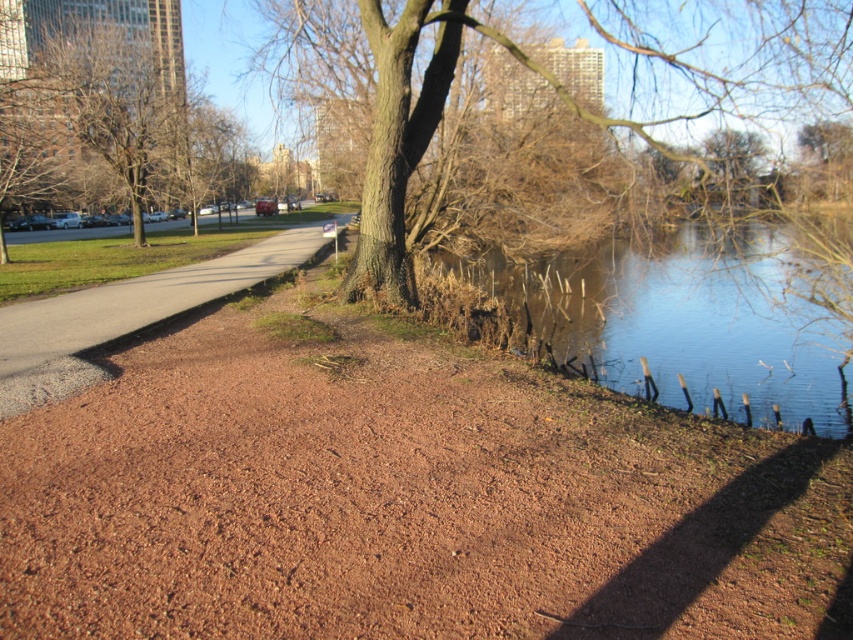
Question: Among these points, which one is nearest to the camera?

Choices:
 (A) (709, 588)
 (B) (62, 102)
 (C) (379, 154)
 (D) (270, 248)

Answer: (A)

Question: Which point appears closest to the camera in this image?

Choices:
 (A) (234, 284)
 (B) (415, 161)

Answer: (B)

Question: Is brown dirt path at center positioned in front of bare wood tree at upper left?

Choices:
 (A) no
 (B) yes

Answer: (B)

Question: Can you confirm if brown dirt path at center is thinner than brown gravel path at left?

Choices:
 (A) no
 (B) yes

Answer: (A)

Question: Which object is farther from the camera taking this photo?

Choices:
 (A) brown gravel path at left
 (B) brown dirt path at center
 (C) bare wood tree at upper left
 (D) brown rough bark tree at center

Answer: (C)

Question: Can you confirm if brown rough bark tree at center is wider than bare wood tree at upper left?

Choices:
 (A) no
 (B) yes

Answer: (B)